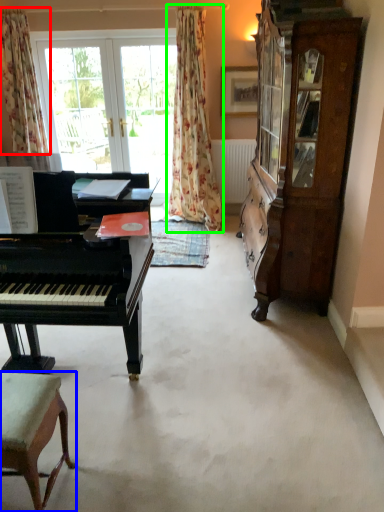
Question: Which object is the closest to the curtain (highlighted by a red box)? Choose among these: chair (highlighted by a blue box) or curtain (highlighted by a green box).

Choices:
 (A) chair
 (B) curtain

Answer: (B)